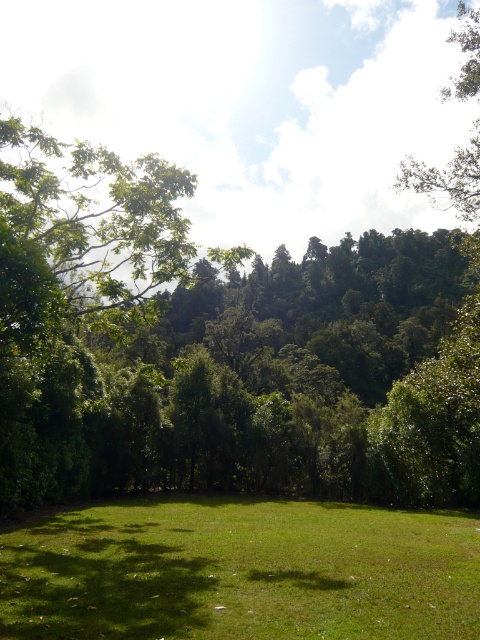
Is green grass at center smaller than green leafy tree at upper right?

Correct, green grass at center occupies less space than green leafy tree at upper right.

At what (x,y) coordinates should I click in order to perform the action: click on green grass at center. Please return your answer as a coordinate pair (x, y). Image resolution: width=480 pixels, height=640 pixels. Looking at the image, I should click on (240, 572).

Image resolution: width=480 pixels, height=640 pixels. I want to click on green grass at center, so click(240, 572).